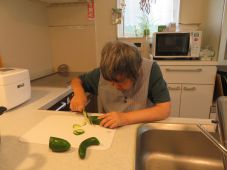
Locate an element on the screen. Image resolution: width=227 pixels, height=170 pixels. cabinet doors is located at coordinates (179, 93), (189, 95).